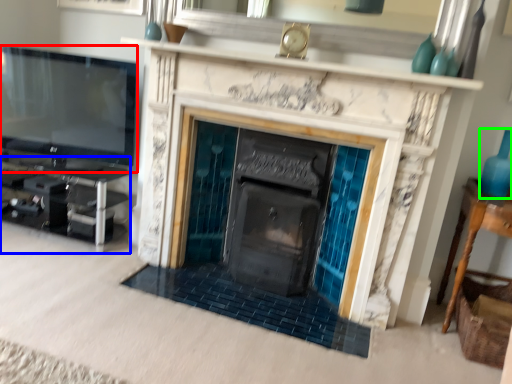
Question: Based on their relative distances, which object is nearer to television (highlighted by a red box)? Choose from entertainment center (highlighted by a blue box) and glass vase (highlighted by a green box).

Choices:
 (A) entertainment center
 (B) glass vase

Answer: (A)